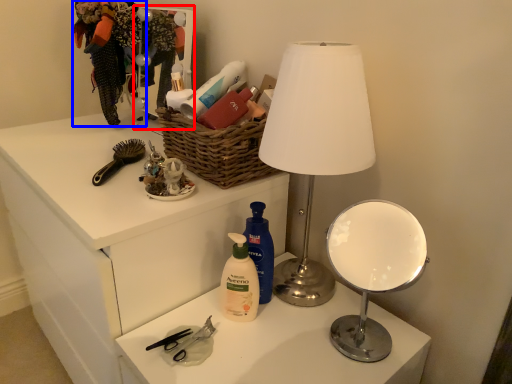
Question: Among these objects, which one is farthest to the camera, mirror (highlighted by a red box) or clothing (highlighted by a blue box)?

Choices:
 (A) mirror
 (B) clothing

Answer: (B)